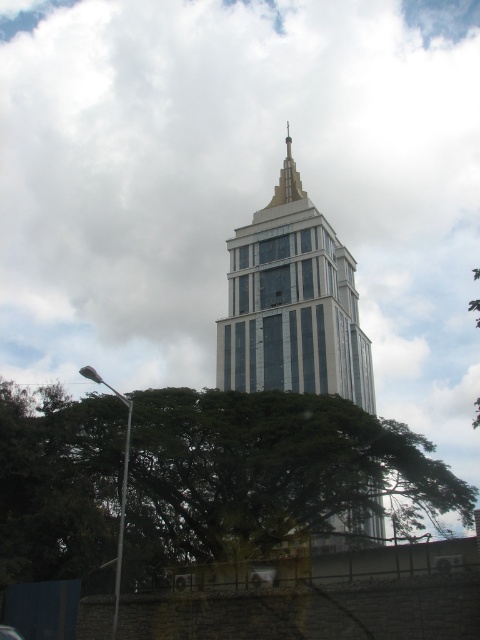
You are an architect reviewing the building design. You notice the white fluffy cloud at upper center and the shiny gold spire at center. Which object is positioned higher in the sky?

The white fluffy cloud at upper center is located above the shiny gold spire at center, so it is positioned higher in the sky.

You are an architect analyzing the building design. From your observation point, which object, the white fluffy cloud at upper center or the metallic glass tower at center, appears larger in height when viewed from the ground?

The white fluffy cloud at upper center appears larger in height than the metallic glass tower at center because it is taller.

You are standing at the point marked as point (43, 436) and want to take a photo of the building. The camera you are using has a maximum zoom range of 100 feet. Will you be able to capture the entire building in your photo without moving closer?

The distance between point (43, 436) and the camera is 141.81 feet. Since the camera can only zoom up to 100 feet, you will not be able to capture the entire building without moving closer.